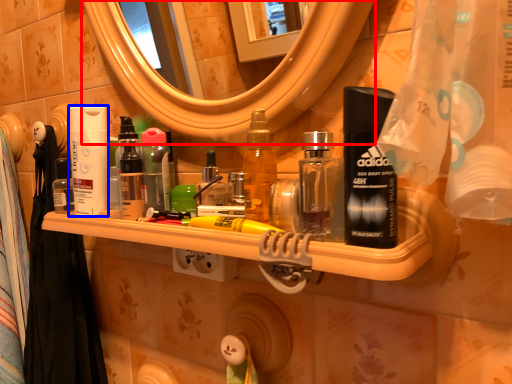
Question: Which of the following is the closest to the observer, mirror (highlighted by a red box) or cleaning product (highlighted by a blue box)?

Choices:
 (A) mirror
 (B) cleaning product

Answer: (A)